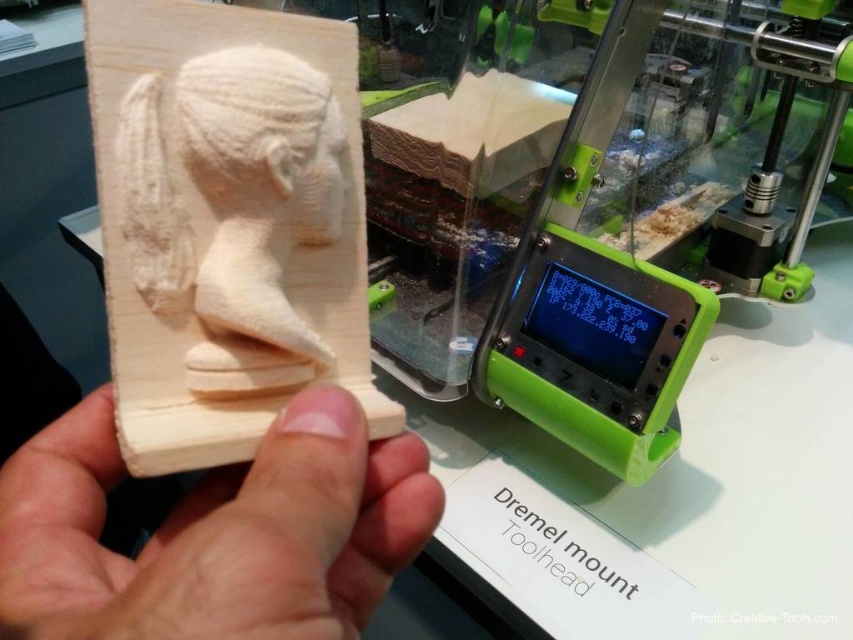
Question: Does light wood at center come behind wooden sculpture at center?

Choices:
 (A) no
 (B) yes

Answer: (A)

Question: Which point is farther from the camera taking this photo?

Choices:
 (A) (16, 486)
 (B) (265, 198)
 (C) (297, 88)

Answer: (B)

Question: Considering the real-world distances, which object is closest to the wooden sculpture at center?

Choices:
 (A) light wood at center
 (B) white wood carving at center

Answer: (B)

Question: Can you confirm if wooden sculpture at center is positioned below white wood carving at center?

Choices:
 (A) no
 (B) yes

Answer: (B)

Question: Which of the following is the farthest from the observer?

Choices:
 (A) light wood at center
 (B) white wood carving at center

Answer: (B)

Question: Can you confirm if light wood at center is positioned above white wood carving at center?

Choices:
 (A) no
 (B) yes

Answer: (A)